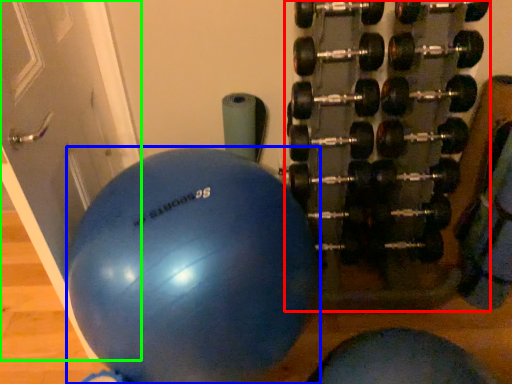
Question: Considering the real-world distances, which object is closest to dumbbell (highlighted by a red box)? ball (highlighted by a blue box) or door (highlighted by a green box).

Choices:
 (A) ball
 (B) door

Answer: (A)